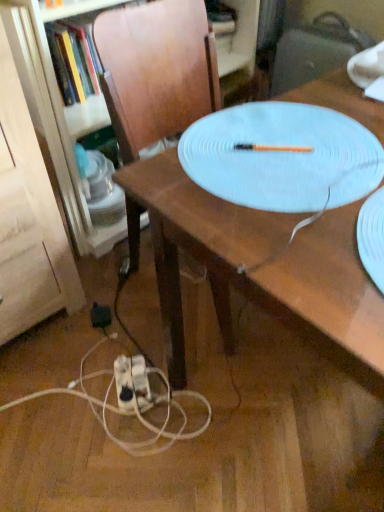
Question: From a real-world perspective, is wooden table at center located beneath black plastic electric outlet at lower left?

Choices:
 (A) no
 (B) yes

Answer: (A)

Question: Is wooden table at center taller than black plastic electric outlet at lower left?

Choices:
 (A) yes
 (B) no

Answer: (A)

Question: Is wooden table at center not within black plastic electric outlet at lower left?

Choices:
 (A) yes
 (B) no

Answer: (A)

Question: Considering the relative sizes of wooden table at center and black plastic electric outlet at lower left in the image provided, is wooden table at center thinner than black plastic electric outlet at lower left?

Choices:
 (A) no
 (B) yes

Answer: (A)

Question: Does wooden table at center appear on the right side of black plastic electric outlet at lower left?

Choices:
 (A) yes
 (B) no

Answer: (A)

Question: Is white plastic extension cord at lower center wider or thinner than wooden table at center?

Choices:
 (A) wide
 (B) thin

Answer: (B)

Question: Is white plastic extension cord at lower center bigger or smaller than wooden table at center?

Choices:
 (A) small
 (B) big

Answer: (A)

Question: From the image's perspective, relative to wooden table at center, is white plastic extension cord at lower center above or below?

Choices:
 (A) below
 (B) above

Answer: (A)

Question: Is white plastic extension cord at lower center to the left or to the right of wooden table at center in the image?

Choices:
 (A) left
 (B) right

Answer: (A)

Question: Does point (357, 212) appear closer or farther from the camera than point (264, 204)?

Choices:
 (A) farther
 (B) closer

Answer: (B)

Question: From the image's perspective, is wooden table at center located above or below white textured platter at center?

Choices:
 (A) below
 (B) above

Answer: (A)

Question: In terms of width, does wooden table at center look wider or thinner when compared to white textured platter at center?

Choices:
 (A) thin
 (B) wide

Answer: (B)

Question: Based on their sizes in the image, would you say wooden table at center is bigger or smaller than white textured platter at center?

Choices:
 (A) small
 (B) big

Answer: (B)

Question: From the image's perspective, is white textured platter at center above or below wooden table at center?

Choices:
 (A) above
 (B) below

Answer: (A)

Question: Based on their sizes in the image, would you say white textured platter at center is bigger or smaller than wooden table at center?

Choices:
 (A) big
 (B) small

Answer: (B)